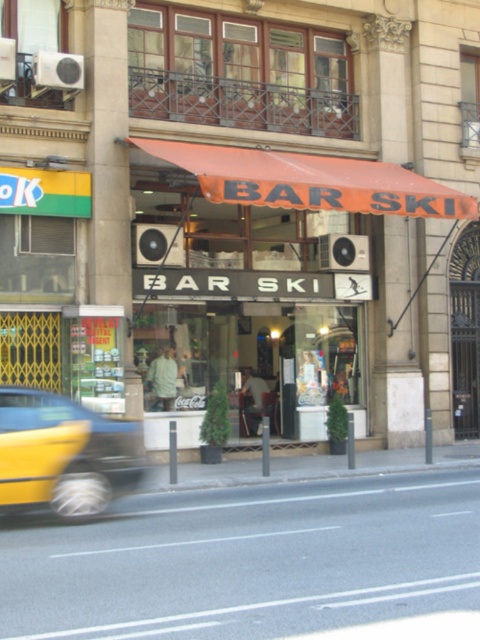
Which is behind, point (50, 614) or point (0, 454)?

The point (0, 454) is behind.

Which is more to the left, yellow rubber tire at lower left or yellow matte taxi at left?

yellow matte taxi at left is more to the left.

At what (x,y) coordinates should I click in order to perform the action: click on yellow rubber tire at lower left. Please return your answer as a coordinate pair (x, y). This screenshot has width=480, height=640. Looking at the image, I should click on (247, 561).

Between orange fabric awning at center and yellow matte taxi at left, which one appears on the left side from the viewer's perspective?

yellow matte taxi at left

Who is more distant from viewer, (168, 150) or (52, 396)?

Positioned behind is point (168, 150).

Image resolution: width=480 pixels, height=640 pixels. I want to click on orange fabric awning at center, so click(x=310, y=180).

Can you confirm if yellow rubber tire at lower left is smaller than orange fabric awning at center?

No, yellow rubber tire at lower left is not smaller than orange fabric awning at center.

Does point (2, 595) come behind point (288, 192)?

No, it is in front of (288, 192).

At what (x,y) coordinates should I click in order to perform the action: click on yellow rubber tire at lower left. Please return your answer as a coordinate pair (x, y). This screenshot has width=480, height=640. Looking at the image, I should click on (247, 561).